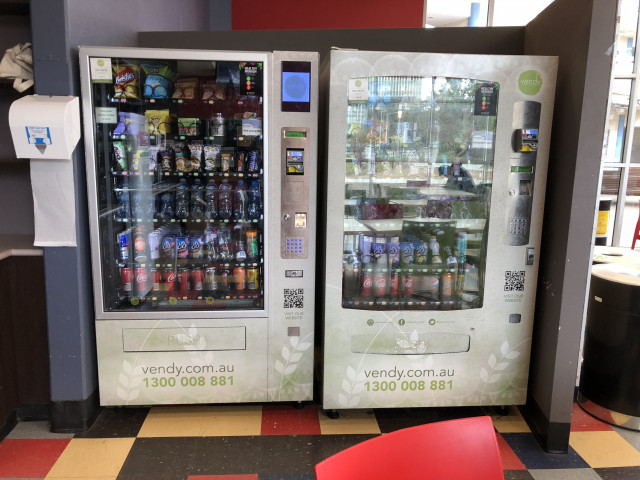
The height and width of the screenshot is (480, 640). I want to click on door, so click(214, 347), click(411, 344).